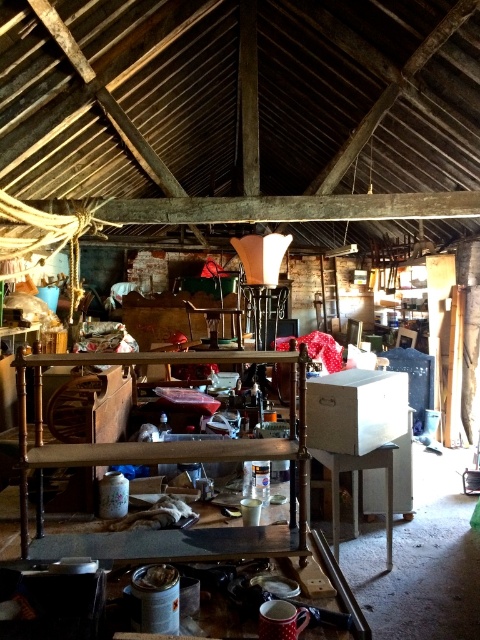
Question: Which of the following is the farthest from the observer?

Choices:
 (A) white glossy table at center
 (B) wooden shelf at center

Answer: (A)

Question: Is wooden shelf at center wider than white glossy table at center?

Choices:
 (A) yes
 (B) no

Answer: (A)

Question: Is wooden shelf at center smaller than white glossy table at center?

Choices:
 (A) yes
 (B) no

Answer: (B)

Question: Does wooden shelf at center have a larger size compared to white glossy table at center?

Choices:
 (A) yes
 (B) no

Answer: (A)